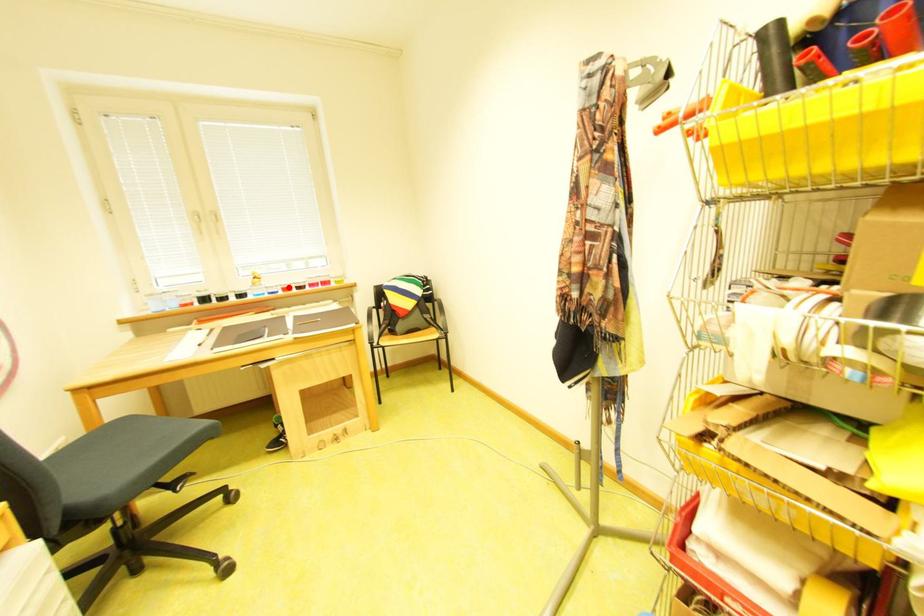
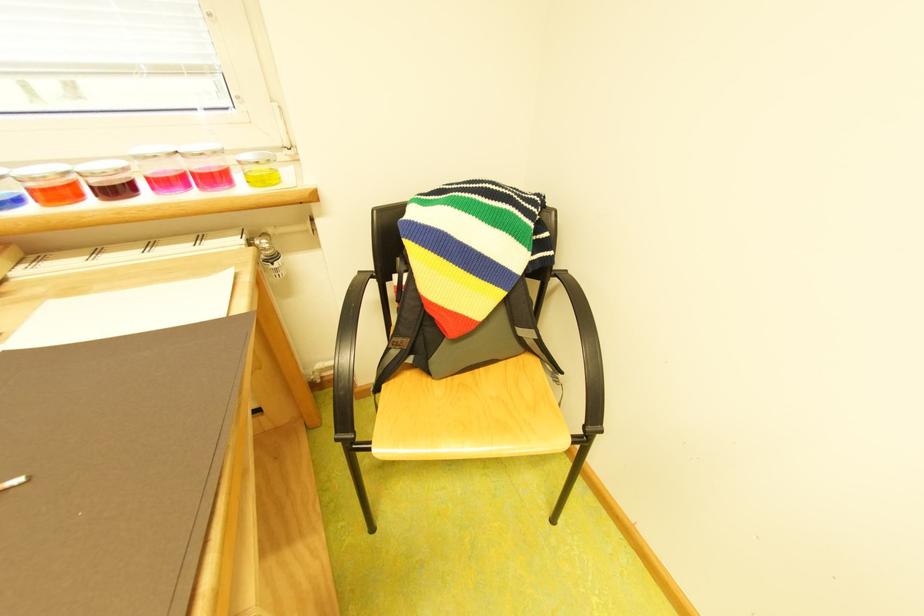
Question: I am providing you with two images of the same scene from different viewpoints. Given a red point in image1, look at the same physical point in image2. Is it:

Choices:
 (A) Closer to the viewpoint
 (B) Farther from the viewpoint

Answer: (B)